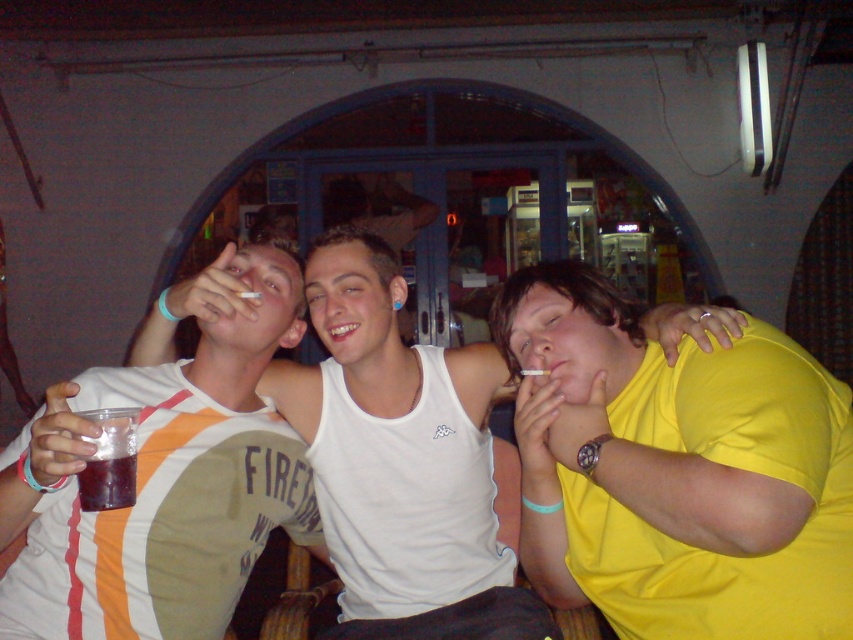
Question: Can you confirm if yellow matte shirt at center is positioned below dark purple liquid at lower left?

Choices:
 (A) yes
 (B) no

Answer: (A)

Question: Estimate the real-world distances between objects in this image. Which object is farther from the white cotton t-shirt at center?

Choices:
 (A) dark purple liquid at lower left
 (B) yellow matte shirt at center
 (C) white tank top at center

Answer: (B)

Question: Which object is the closest to the yellow matte shirt at center?

Choices:
 (A) white cotton t-shirt at center
 (B) white tank top at center
 (C) dark purple liquid at lower left

Answer: (B)

Question: Which object is closer to the camera taking this photo?

Choices:
 (A) yellow matte shirt at center
 (B) dark purple liquid at lower left
 (C) white cotton t-shirt at center
 (D) white tank top at center

Answer: (A)

Question: Does yellow matte shirt at center appear over white cotton t-shirt at center?

Choices:
 (A) yes
 (B) no

Answer: (B)

Question: Is white cotton t-shirt at center positioned at the back of white tank top at center?

Choices:
 (A) no
 (B) yes

Answer: (A)